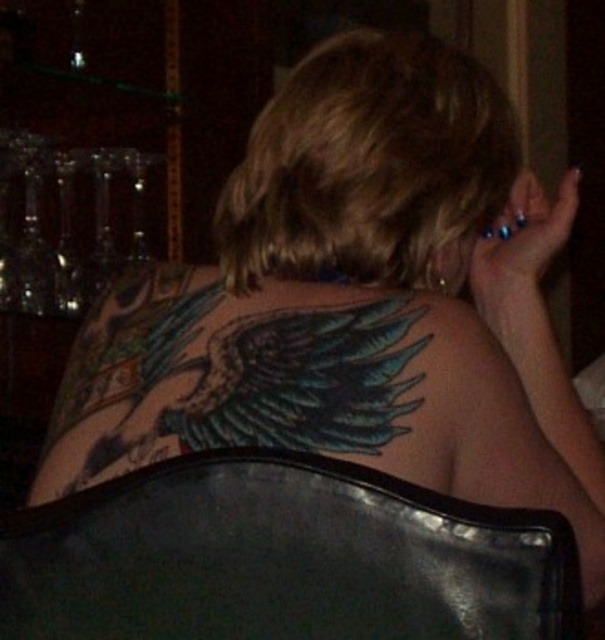
Question: Is black leather chair at lower center to the right of colorful ink wings at upper back from the viewer's perspective?

Choices:
 (A) no
 (B) yes

Answer: (B)

Question: Which point is closer to the camera taking this photo?

Choices:
 (A) (140, 586)
 (B) (194, 289)

Answer: (A)

Question: Which point appears closest to the camera in this image?

Choices:
 (A) coord(194,592)
 (B) coord(335,300)

Answer: (A)

Question: Which of the following is the closest to the observer?

Choices:
 (A) (87, 472)
 (B) (405, 612)

Answer: (B)

Question: Can you confirm if black leather chair at lower center is positioned to the left of colorful ink wings at upper back?

Choices:
 (A) no
 (B) yes

Answer: (A)

Question: Can you confirm if black leather chair at lower center is thinner than colorful ink wings at upper back?

Choices:
 (A) yes
 (B) no

Answer: (B)